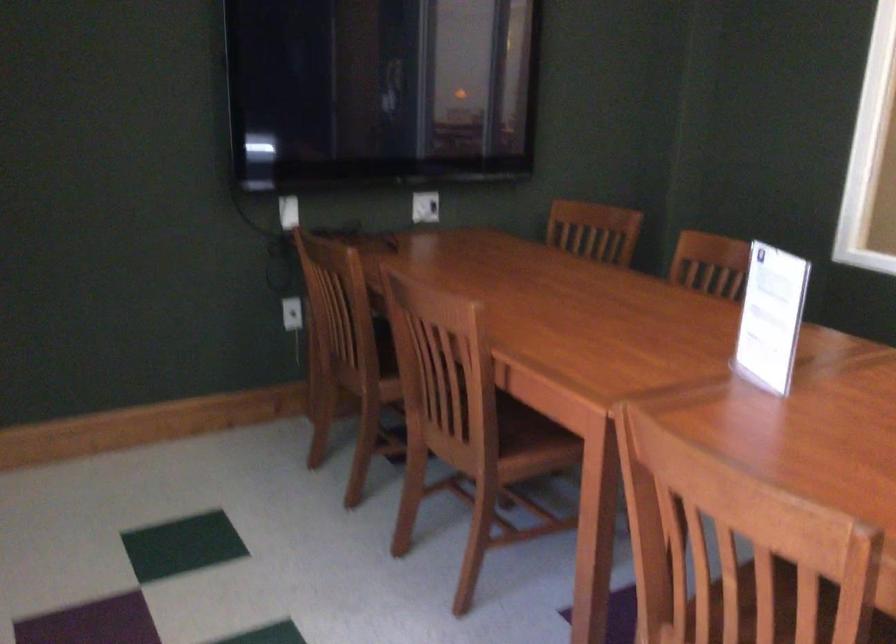
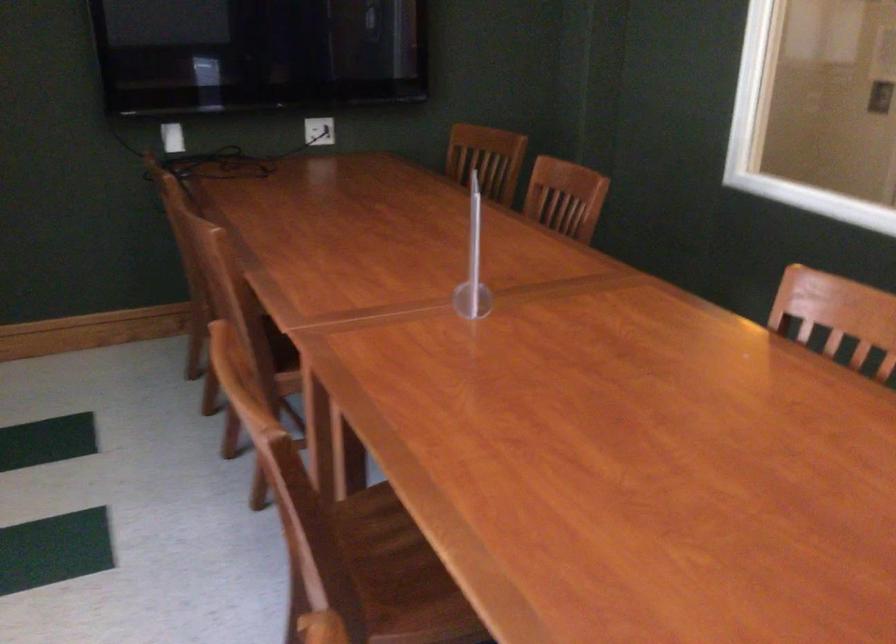
In the second image, find the point that corresponds to point (702, 335) in the first image.

(472, 263)